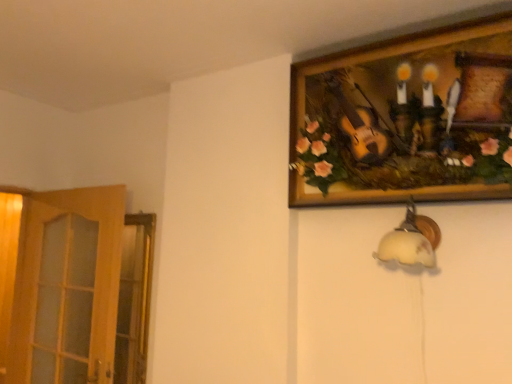
Question: Should I look upward or downward to see wooden picture frame at upper right?

Choices:
 (A) up
 (B) down

Answer: (A)

Question: From a real-world perspective, is wooden picture frame at upper right on white frosted glass lampshade at lower right?

Choices:
 (A) no
 (B) yes

Answer: (B)

Question: Is wooden picture frame at upper right turned away from white frosted glass lampshade at lower right?

Choices:
 (A) yes
 (B) no

Answer: (B)

Question: Could you tell me if wooden picture frame at upper right is facing white frosted glass lampshade at lower right?

Choices:
 (A) yes
 (B) no

Answer: (B)

Question: Is the surface of wooden picture frame at upper right in direct contact with white frosted glass lampshade at lower right?

Choices:
 (A) no
 (B) yes

Answer: (A)

Question: Does wooden picture frame at upper right have a lesser height compared to white frosted glass lampshade at lower right?

Choices:
 (A) no
 (B) yes

Answer: (A)

Question: Does wooden picture frame at upper right come behind white frosted glass lampshade at lower right?

Choices:
 (A) no
 (B) yes

Answer: (A)

Question: Is wooden at left to the right of white frosted glass lampshade at lower right from the viewer's perspective?

Choices:
 (A) yes
 (B) no

Answer: (B)

Question: Does wooden at left turn towards white frosted glass lampshade at lower right?

Choices:
 (A) yes
 (B) no

Answer: (B)

Question: Is wooden at left touching white frosted glass lampshade at lower right?

Choices:
 (A) yes
 (B) no

Answer: (B)

Question: From the image's perspective, is wooden at left on white frosted glass lampshade at lower right?

Choices:
 (A) yes
 (B) no

Answer: (B)

Question: Considering the relative sizes of wooden at left and white frosted glass lampshade at lower right in the image provided, is wooden at left thinner than white frosted glass lampshade at lower right?

Choices:
 (A) yes
 (B) no

Answer: (A)

Question: Is white frosted glass lampshade at lower right inside wooden at left?

Choices:
 (A) no
 (B) yes

Answer: (A)

Question: Is white frosted glass lampshade at lower right not within wooden picture frame at upper right?

Choices:
 (A) no
 (B) yes

Answer: (B)